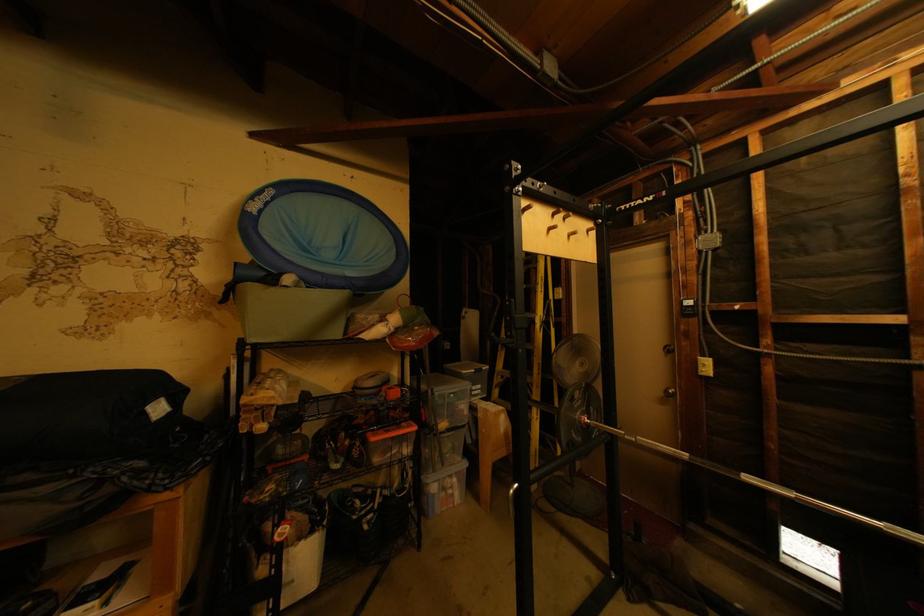
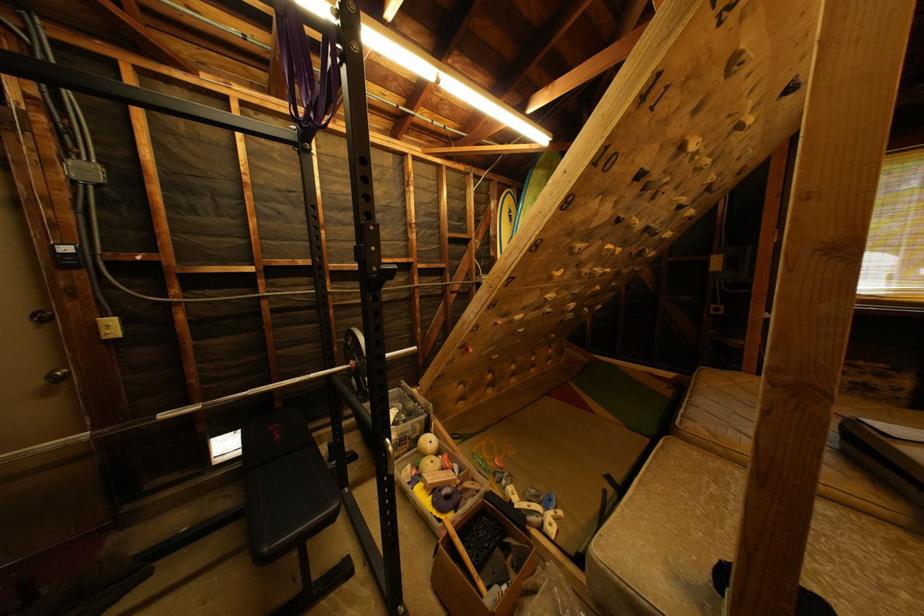
Question: The camera is either moving clockwise (left) or counter-clockwise (right) around the object. The first image is from the beginning of the video and the second image is from the end. Is the camera moving left or right when shooting the video?

Choices:
 (A) Left
 (B) Right

Answer: (A)